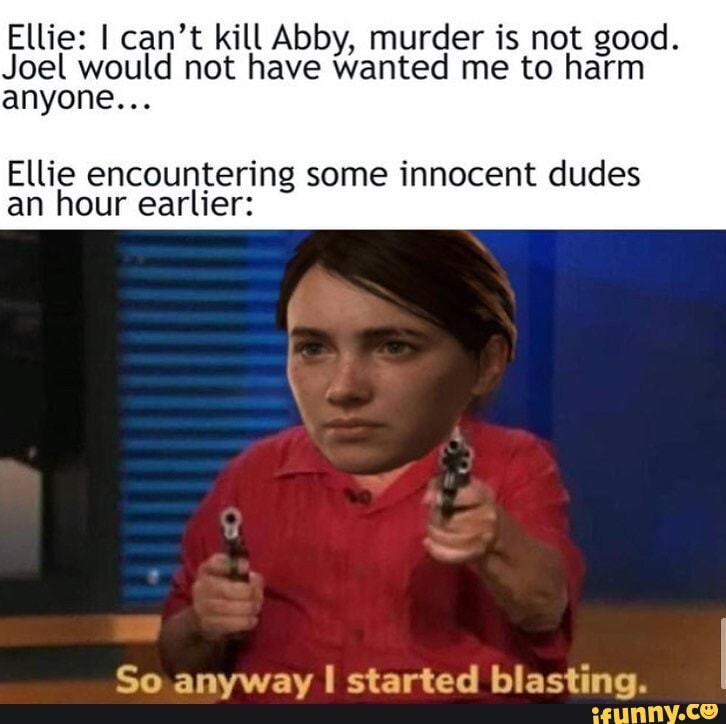
The height and width of the screenshot is (724, 726). I want to click on blinds, so click(181, 382).